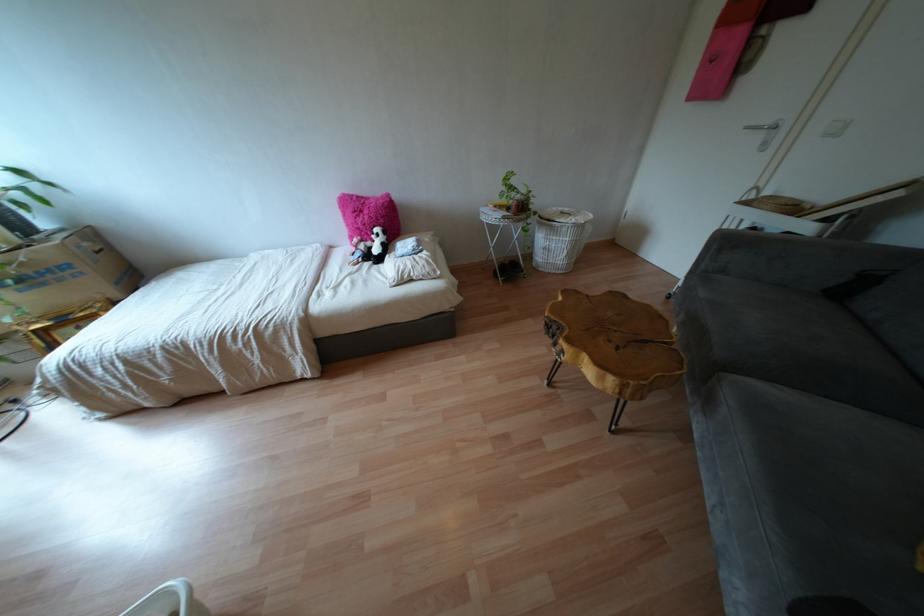
I want to click on wicker basket lid, so point(565,215).